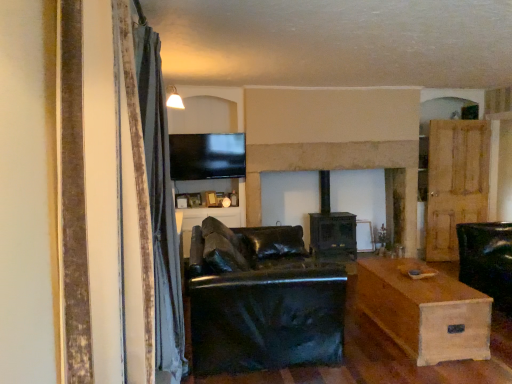
Measure the distance between wooden door at right and camera.

wooden door at right is 17.65 feet away from camera.

The width and height of the screenshot is (512, 384). I want to click on velvet gray curtain at left, so click(160, 208).

At what (x,y) coordinates should I click in order to perform the action: click on light brown wooden table at lower right. Please return your answer as a coordinate pair (x, y). The width and height of the screenshot is (512, 384). Looking at the image, I should click on (425, 311).

In the image, there is a light brown wooden table at lower right. Where is `studio couch above it (from the image's perspective)`? This screenshot has height=384, width=512. studio couch above it (from the image's perspective) is located at coordinates (262, 300).

Which object is thinner, black leather couch at center or light brown wooden table at lower right?

A: With smaller width is light brown wooden table at lower right.

Are black leather couch at center and light brown wooden table at lower right beside each other?

No.

Can you confirm if black leather couch at center is bigger than light brown wooden table at lower right?

Yes.

What's the angular difference between wooden door at right and light brown wooden table at lower right's facing directions?

The angular difference between wooden door at right and light brown wooden table at lower right is 85.5 degrees.

Which is in front, point (487, 209) or point (460, 330)?

The point (460, 330) is closer.

Is wooden door at right further to camera compared to light brown wooden table at lower right?

Yes.

Visually, is wooden door at right positioned to the left or to the right of light brown wooden table at lower right?

In the image, wooden door at right appears on the right side of light brown wooden table at lower right.

Is velvet gray curtain at left taller or shorter than flat screen tv at upper center?

Considering their sizes, velvet gray curtain at left has more height than flat screen tv at upper center.

Can you tell me how much velvet gray curtain at left and flat screen tv at upper center differ in facing direction?

The angle between the facing direction of velvet gray curtain at left and the facing direction of flat screen tv at upper center is 88.9 degrees.

Find the location of a particular element. curtain that appears below the flat screen tv at upper center (from a real-world perspective) is located at coordinates (160, 208).

Which is closer to the camera, (159,54) or (176,149)?

Point (159,54)

Between flat screen tv at upper center and wooden door at right, which one appears on the left side from the viewer's perspective?

From the viewer's perspective, flat screen tv at upper center appears more on the left side.

Which point is more distant from viewer, (199, 162) or (445, 259)?

Point (445, 259)

In the image, is flat screen tv at upper center positioned in front of or behind wooden door at right?

flat screen tv at upper center is in front of wooden door at right.

Between flat screen tv at upper center and wooden door at right, which one has larger size?

wooden door at right is bigger.

Does point (298, 254) lie behind point (470, 161)?

No.

In the image, is black leather couch at center positioned in front of or behind wooden door at right?

black leather couch at center is in front of wooden door at right.

Between black leather couch at center and wooden door at right, which one has larger width?

black leather couch at center.

Where is `door above the black leather couch at center (from the image's perspective)`? This screenshot has height=384, width=512. door above the black leather couch at center (from the image's perspective) is located at coordinates (455, 183).

Is light brown wooden table at lower right inside or outside of black leather couch at center?

light brown wooden table at lower right is not enclosed by black leather couch at center.

Does light brown wooden table at lower right appear on the right side of black leather couch at center?

Yes.

Considering the relative sizes of light brown wooden table at lower right and black leather couch at center in the image provided, is light brown wooden table at lower right taller than black leather couch at center?

No, light brown wooden table at lower right is not taller than black leather couch at center.

Considering the sizes of light brown wooden table at lower right and black leather couch at center in the image, is light brown wooden table at lower right wider or thinner than black leather couch at center?

In the image, light brown wooden table at lower right appears to be more narrow than black leather couch at center.

Could you tell me if flat screen tv at upper center is facing stone fireplace at center?

No, flat screen tv at upper center does not turn towards stone fireplace at center.

Who is smaller, flat screen tv at upper center or stone fireplace at center?

flat screen tv at upper center is smaller.

Which is more to the right, flat screen tv at upper center or stone fireplace at center?

stone fireplace at center is more to the right.

Is flat screen tv at upper center not within stone fireplace at center?

flat screen tv at upper center is positioned outside stone fireplace at center.

The image size is (512, 384). I want to click on table lying behind the black leather couch at center, so click(425, 311).

Locate an element on the screen. door above the light brown wooden table at lower right (from the image's perspective) is located at coordinates (455, 183).

From the image, which object appears to be nearer to velvet gray curtain at left, black leather couch at center or flat screen tv at upper center?

black leather couch at center is positioned closer to the anchor velvet gray curtain at left.

Estimate the real-world distances between objects in this image. Which object is further from stone fireplace at center, flat screen tv at upper center or black leather couch at center?

Among the two, black leather couch at center is located further to stone fireplace at center.

Which object lies nearer to the anchor point flat screen tv at upper center, black leather couch at center or stone fireplace at center?

stone fireplace at center is closer to flat screen tv at upper center.

Which object lies further to the anchor point black leather couch at center, light brown wooden table at lower right or flat screen tv at upper center?

The object further to black leather couch at center is flat screen tv at upper center.

When comparing their distances from flat screen tv at upper center, does stone fireplace at center or light brown wooden table at lower right seem closer?

stone fireplace at center is closer to flat screen tv at upper center.

Considering their positions, is light brown wooden table at lower right positioned closer to stone fireplace at center than wooden door at right?

wooden door at right is closer to stone fireplace at center.

When comparing their distances from flat screen tv at upper center, does stone fireplace at center or velvet gray curtain at left seem further?

The object further to flat screen tv at upper center is velvet gray curtain at left.

When comparing their distances from black leather couch at center, does light brown wooden table at lower right or velvet gray curtain at left seem closer?

The object closer to black leather couch at center is velvet gray curtain at left.

Find the location of a particular element. The height and width of the screenshot is (384, 512). table located between velvet gray curtain at left and flat screen tv at upper center in the depth direction is located at coordinates (425, 311).

Where is `television positioned between velvet gray curtain at left and stone fireplace at center from near to far`? The width and height of the screenshot is (512, 384). television positioned between velvet gray curtain at left and stone fireplace at center from near to far is located at coordinates (207, 156).

I want to click on table between black leather couch at center and flat screen tv at upper center from front to back, so click(425, 311).

The width and height of the screenshot is (512, 384). What are the coordinates of `table between black leather couch at center and stone fireplace at center from front to back` in the screenshot? It's located at [425, 311].